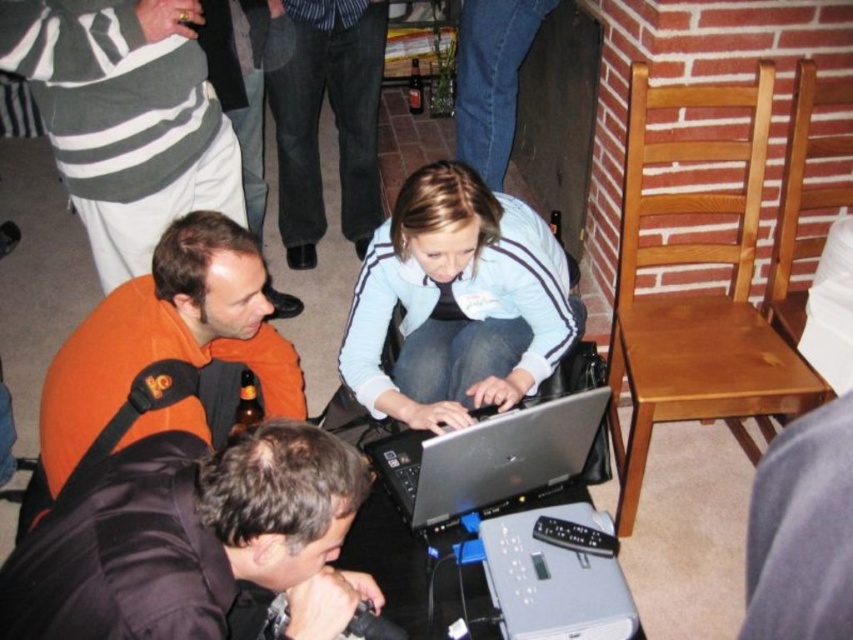
You are standing in the room and want to hand a document to both the light blue fabric jacket at center and the orange fleece jacket at lower left. Which person should you approach first based on their proximity to you?

You should approach the light blue fabric jacket at center first because it is closer to you than the orange fleece jacket at lower left, which is further away.

You are a photographer at the event and need to capture a photo that includes both the light blue fabric jacket at center and the orange fleece jacket at lower left. Based on their positions, which jacket should you focus on first to ensure both are in frame?

The light blue fabric jacket at center is positioned on the right side of the orange fleece jacket at lower left. To include both in the frame, focus on the orange fleece jacket at lower left first, as it is on the left, then adjust to include the right side where the light blue fabric jacket at center is located.